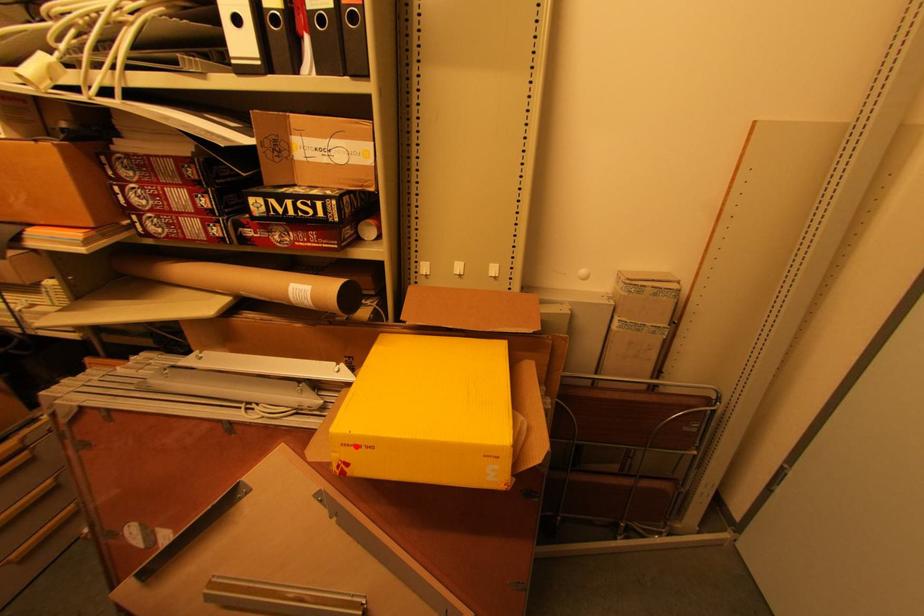
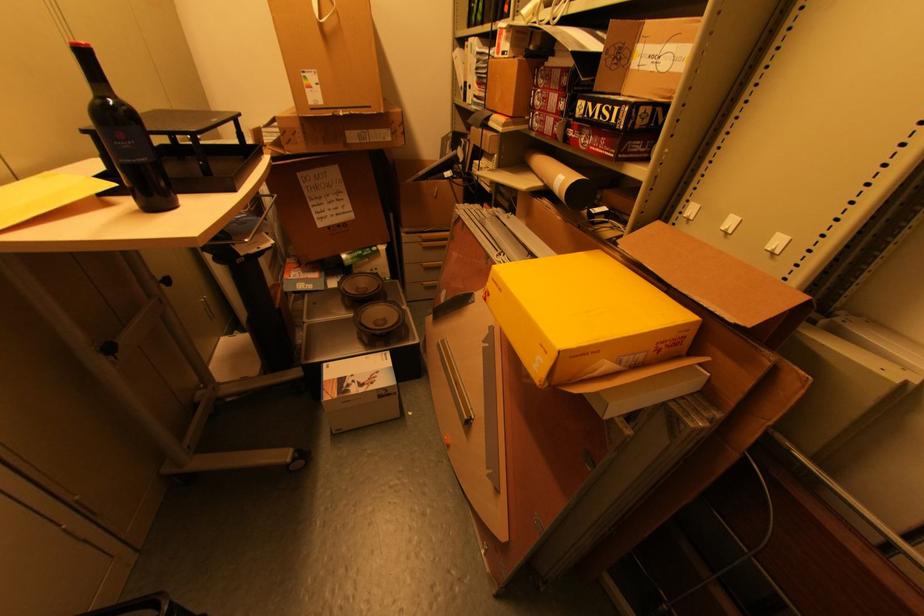
Question: I am providing you with two images of the same scene from different viewpoints. A red point is marked on the first image. Is the red point's position out of view in image 2?

Choices:
 (A) Yes
 (B) No

Answer: (B)